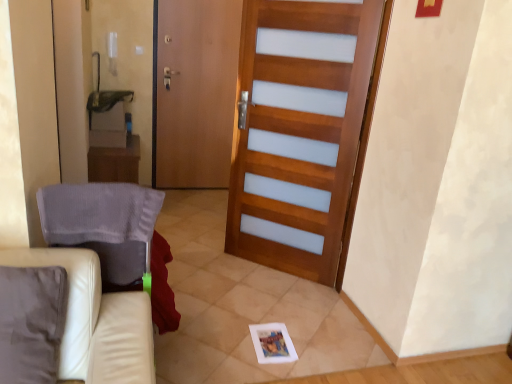
At what (x,y) coordinates should I click in order to perform the action: click on vacant space in wooden barn door at center (from a real-world perspective). Please return your answer as a coordinate pair (x, y). The height and width of the screenshot is (384, 512). Looking at the image, I should click on pyautogui.click(x=275, y=279).